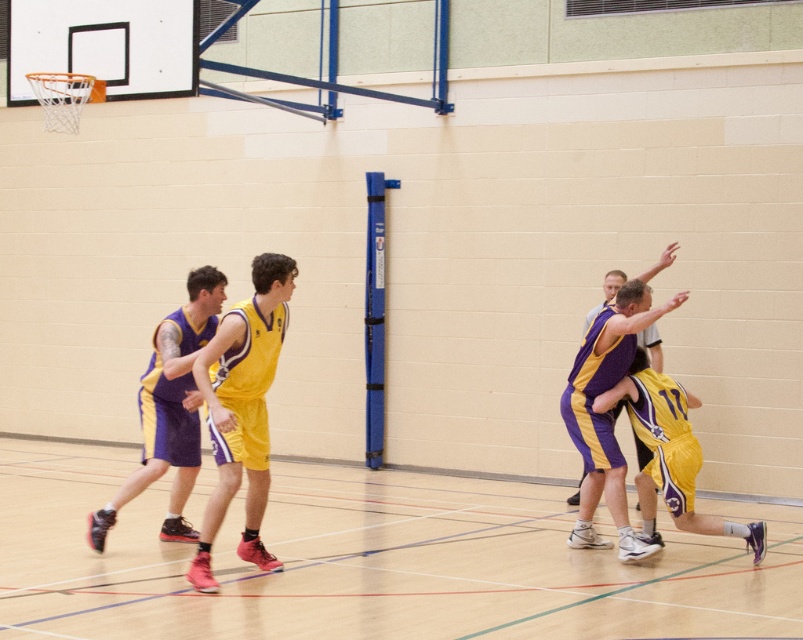
Question: Which of the following is the closest to the observer?

Choices:
 (A) (662, 307)
 (B) (655, 388)

Answer: (A)

Question: Among these points, which one is farthest from the camera?

Choices:
 (A) (243, 429)
 (B) (642, 413)

Answer: (B)

Question: Can you confirm if purple/yellow jersey at center is positioned below yellow matte shorts at center?

Choices:
 (A) no
 (B) yes

Answer: (A)

Question: Does yellow jersey at center appear over purple jersey at center?

Choices:
 (A) yes
 (B) no

Answer: (A)

Question: Does yellow jersey at center appear on the left side of purple/yellow jersey at left?

Choices:
 (A) yes
 (B) no

Answer: (B)

Question: Which point is closer to the camera?

Choices:
 (A) yellow matte shorts at center
 (B) purple/yellow jersey at center
 (C) purple/yellow jersey at left

Answer: (C)